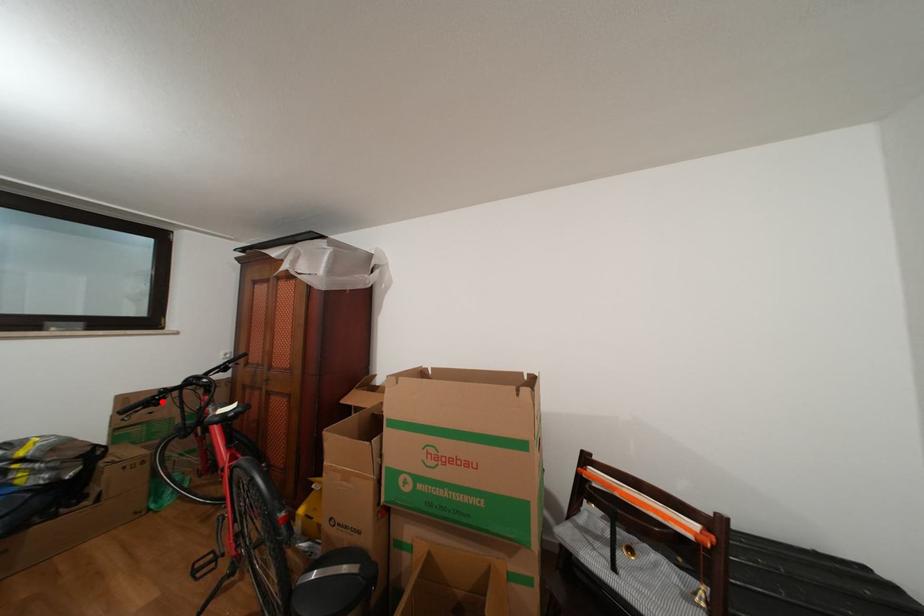
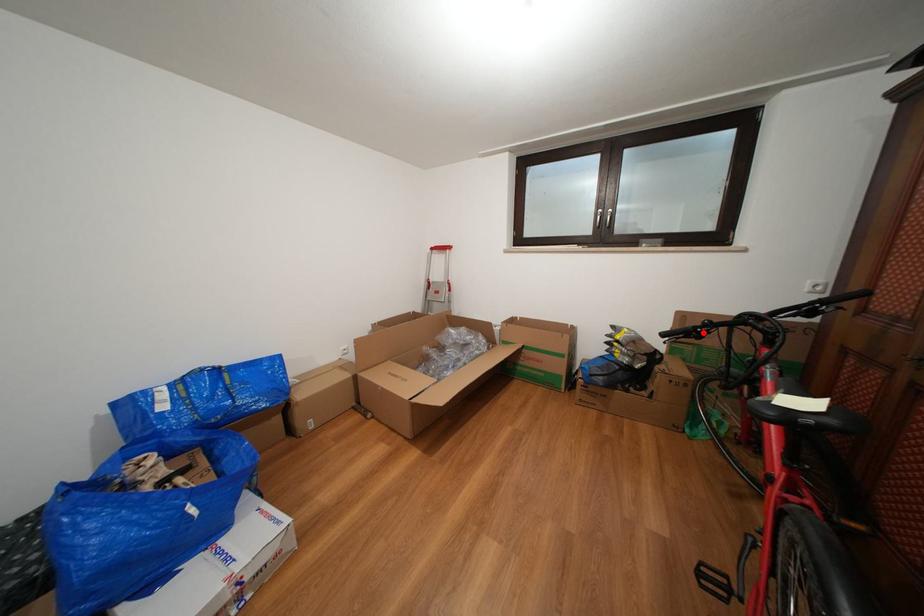
I am providing you with two images of the same scene from different viewpoints. A red point is marked on the first image and another point is marked on the second image. Is the marked point in image1 the same physical position as the marked point in image2?

Yes